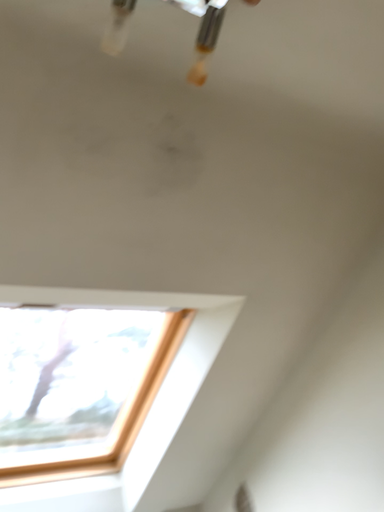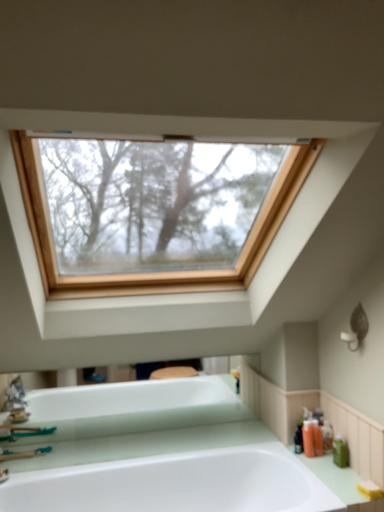
Question: How did the camera likely rotate when shooting the video?

Choices:
 (A) rotated upward
 (B) rotated downward

Answer: (B)